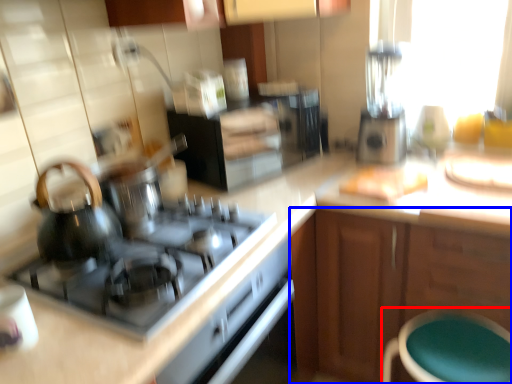
Question: Among these objects, which one is farthest to the camera, bar stool (highlighted by a red box) or cabinetry (highlighted by a blue box)?

Choices:
 (A) bar stool
 (B) cabinetry

Answer: (B)